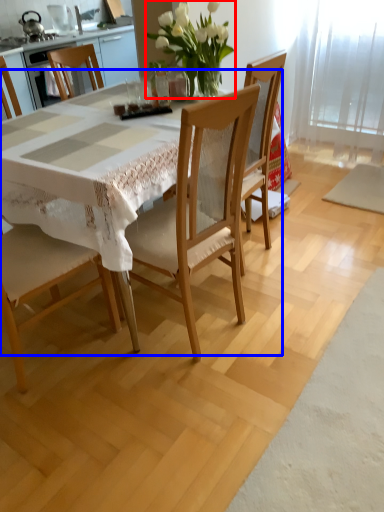
Question: Among these objects, which one is farthest to the camera, floral arrangement (highlighted by a red box) or round table (highlighted by a blue box)?

Choices:
 (A) floral arrangement
 (B) round table

Answer: (A)